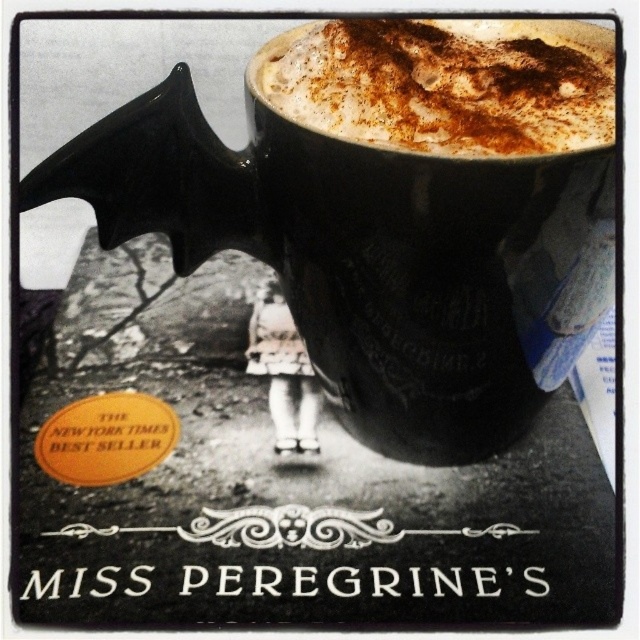
Question: Which of the following is the closest to the observer?

Choices:
 (A) (531, 100)
 (B) (552, 179)

Answer: (B)

Question: Does black matte bat-shaped mug at upper center have a greater width compared to cinnamon froth at upper center?

Choices:
 (A) yes
 (B) no

Answer: (A)

Question: Which point is farther to the camera?

Choices:
 (A) cinnamon froth at upper center
 (B) black matte bat-shaped mug at upper center

Answer: (A)

Question: Can you confirm if black matte bat-shaped mug at upper center is positioned to the left of cinnamon froth at upper center?

Choices:
 (A) no
 (B) yes

Answer: (B)

Question: Can you confirm if black matte bat-shaped mug at upper center is positioned to the left of cinnamon froth at upper center?

Choices:
 (A) yes
 (B) no

Answer: (A)

Question: Which of the following is the farthest from the observer?

Choices:
 (A) cinnamon froth at upper center
 (B) black matte bat-shaped mug at upper center

Answer: (A)